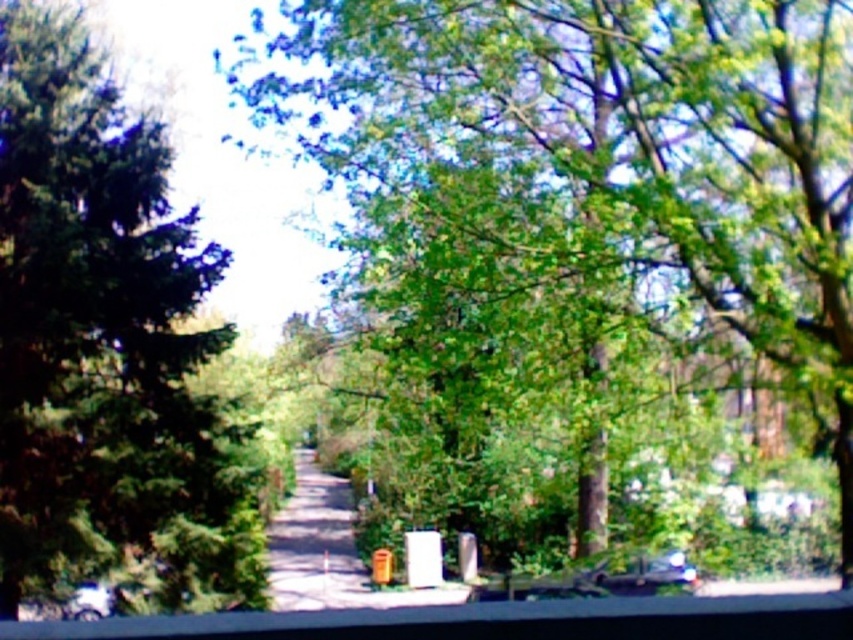
You are standing on the pathway and want to walk towards the point marked as point (791, 189) and point (592, 584). Which point will you reach first?

You will reach point (791, 189) first because it is closer to you than point (592, 584).